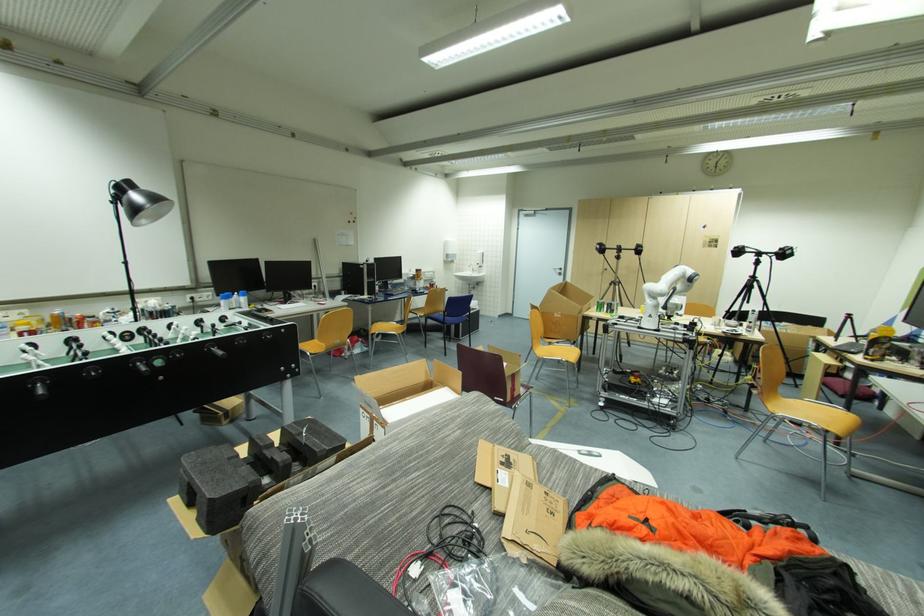
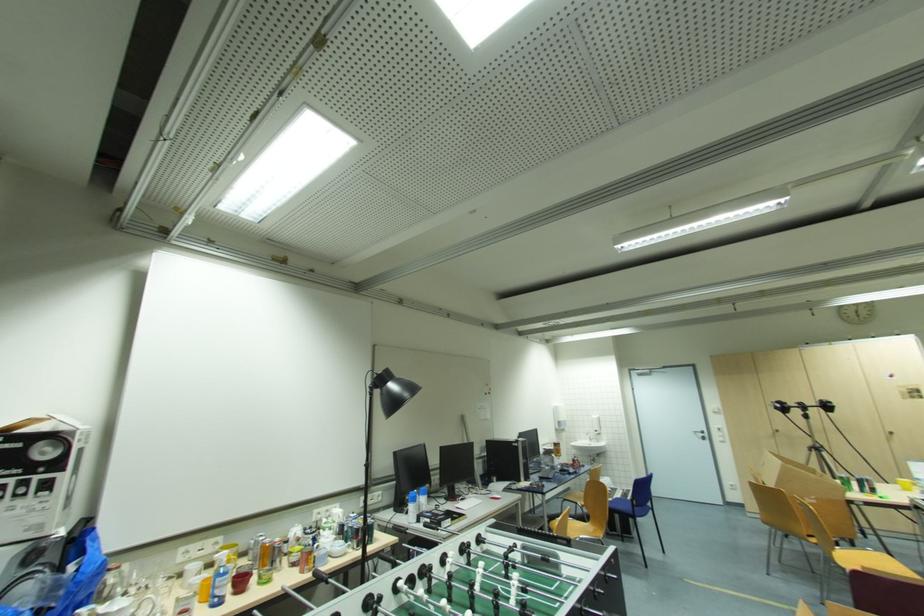
Where in the second image is the point corresponding to pixel 481 265 from the first image?

(601, 434)